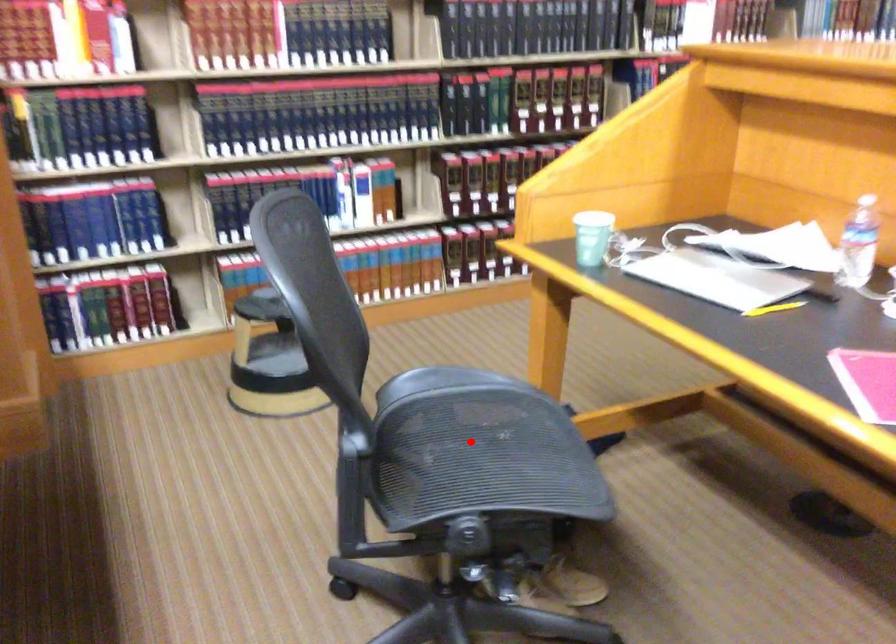
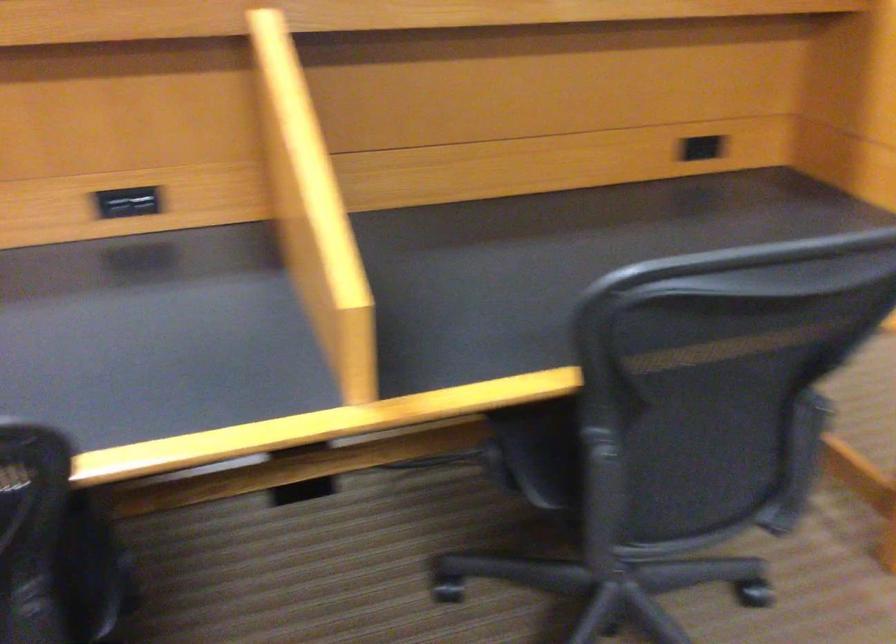
Question: I am providing you with two images of the same scene from different viewpoints. A red point is marked on the first image. Can you still see the location of the red point in image 2?

Choices:
 (A) Yes
 (B) No

Answer: (B)